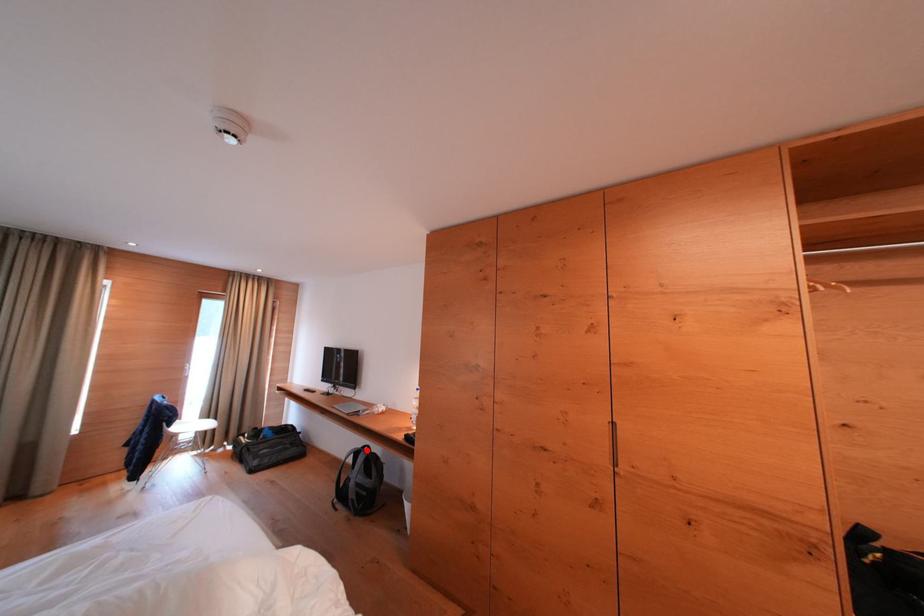
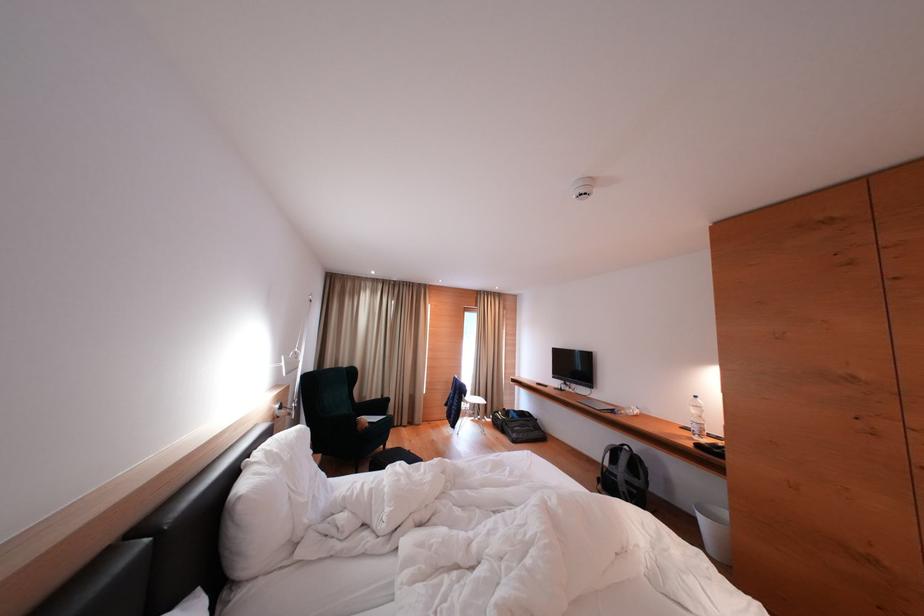
Find the pixel in the second image that matches the highlighted location in the first image.

(624, 448)